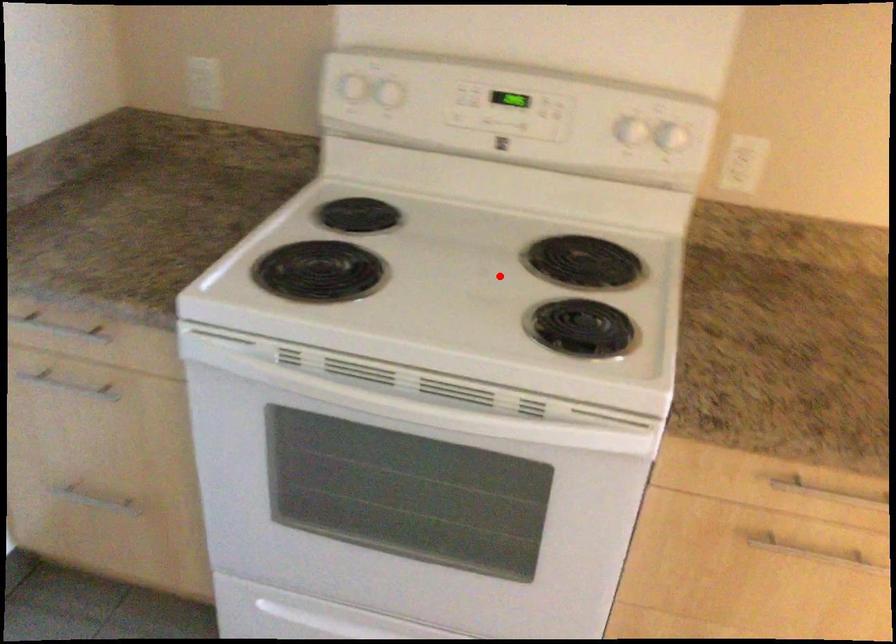
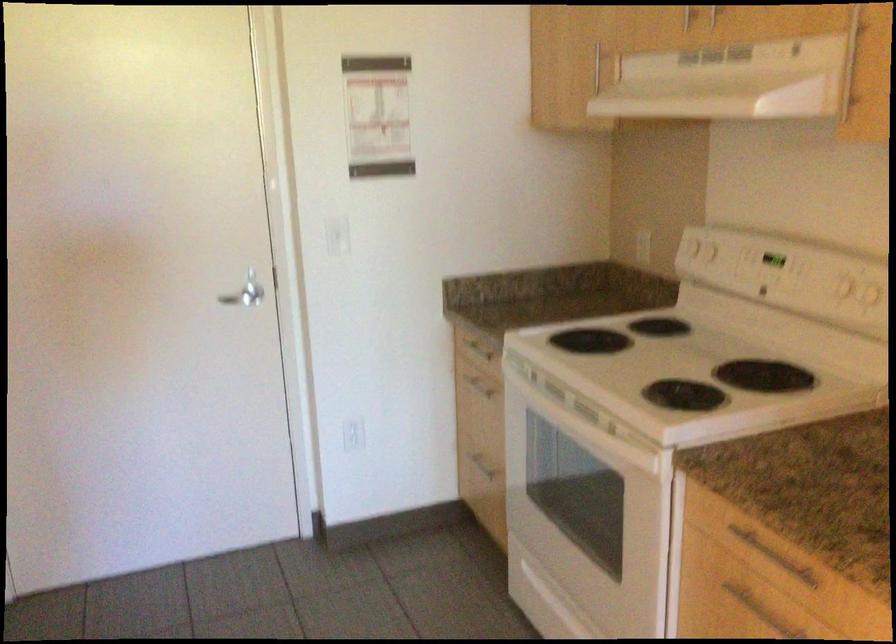
Question: A red point is marked in image1. In image2, is the corresponding 3D point closer to the camera or farther? Reply with the corresponding letter.

Choices:
 (A) The corresponding 3D point is closer.
 (B) The corresponding 3D point is farther.

Answer: (B)